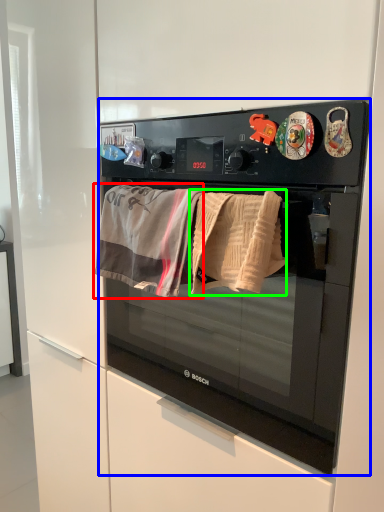
Question: Which object is positioned closest to beach towel (highlighted by a red box)? Select from microwave oven (highlighted by a blue box) and beach towel (highlighted by a green box).

Choices:
 (A) microwave oven
 (B) beach towel

Answer: (B)